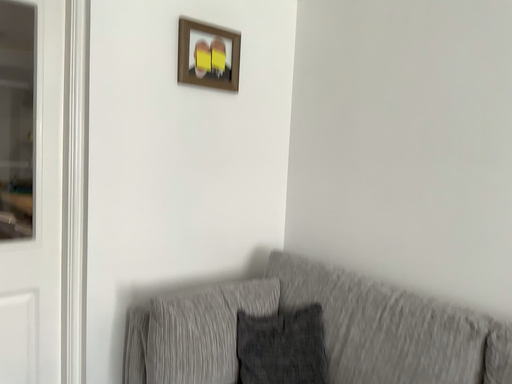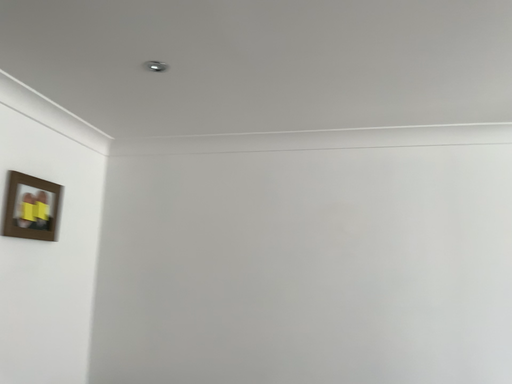
Question: How did the camera likely rotate when shooting the video?

Choices:
 (A) rotated right
 (B) rotated left

Answer: (A)